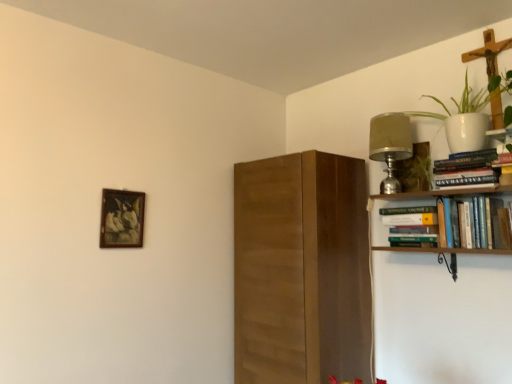
Question: Do you think hardcover book at upper right, which is counted as the second book, starting from the top, is within hardcover books at upper right, arranged as the 1th book when viewed from the top, or outside of it?

Choices:
 (A) inside
 (B) outside

Answer: (B)

Question: From the image's perspective, is hardcover book at upper right, the second book positioned from the bottom, above or below hardcover books at upper right, which is counted as the 3th book, starting from the bottom?

Choices:
 (A) above
 (B) below

Answer: (B)

Question: Which object is the closest to the hardcover books at upper right, marked as the first book in a bottom-to-top arrangement?

Choices:
 (A) hardcover book at upper right, which is counted as the second book, starting from the top
 (B) wooden picture frame at upper left
 (C) white ceramic pot at upper right
 (D) matte silver lamp at upper right
 (E) hardcover books at upper right, arranged as the 1th book when viewed from the top

Answer: (A)

Question: Estimate the real-world distances between objects in this image. Which object is farther from the wooden picture frame at upper left?

Choices:
 (A) hardcover books at upper right, arranged as the 1th book when viewed from the top
 (B) hardcover book at upper right, the second book positioned from the bottom
 (C) hardcover books at upper right, marked as the first book in a bottom-to-top arrangement
 (D) white ceramic pot at upper right
 (E) matte silver lamp at upper right

Answer: (D)